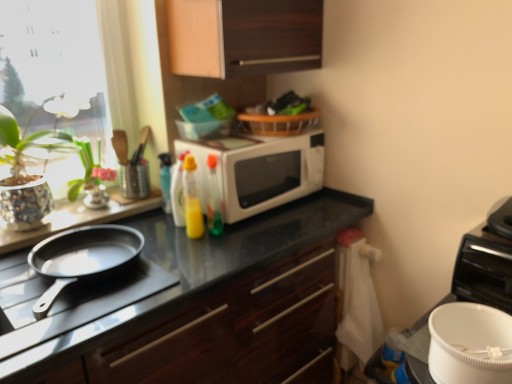
Question: Considering the relative sizes of white glossy microwave at center and green glossy vase at left in the image provided, is white glossy microwave at center smaller than green glossy vase at left?

Choices:
 (A) no
 (B) yes

Answer: (A)

Question: Does white glossy microwave at center have a lesser height compared to green glossy vase at left?

Choices:
 (A) yes
 (B) no

Answer: (B)

Question: Is white glossy microwave at center taller than green glossy vase at left?

Choices:
 (A) yes
 (B) no

Answer: (A)

Question: Could you tell me if white glossy microwave at center is turned towards green glossy vase at left?

Choices:
 (A) no
 (B) yes

Answer: (A)

Question: Does white glossy microwave at center come in front of green glossy vase at left?

Choices:
 (A) no
 (B) yes

Answer: (B)

Question: Looking at the image, does black matte pan at left seem bigger or smaller compared to white glossy microwave at center?

Choices:
 (A) big
 (B) small

Answer: (B)

Question: Is black matte pan at left taller or shorter than white glossy microwave at center?

Choices:
 (A) tall
 (B) short

Answer: (B)

Question: From the image's perspective, is black matte pan at left above or below white glossy microwave at center?

Choices:
 (A) below
 (B) above

Answer: (A)

Question: From a real-world perspective, relative to white glossy microwave at center, is black matte pan at left vertically above or below?

Choices:
 (A) below
 (B) above

Answer: (A)

Question: From their relative heights in the image, would you say translucent plastic spray bottle at upper center, marked as the fourth bottle in a right-to-left arrangement, is taller or shorter than white glossy microwave at center?

Choices:
 (A) short
 (B) tall

Answer: (A)

Question: Based on their positions, is translucent plastic spray bottle at upper center, the first bottle from the left, located to the left or right of white glossy microwave at center?

Choices:
 (A) right
 (B) left

Answer: (B)

Question: From the image's perspective, is translucent plastic spray bottle at upper center, marked as the fourth bottle in a right-to-left arrangement, positioned above or below white glossy microwave at center?

Choices:
 (A) below
 (B) above

Answer: (A)

Question: Relative to white glossy microwave at center, is translucent plastic spray bottle at upper center, marked as the fourth bottle in a right-to-left arrangement, in front or behind?

Choices:
 (A) front
 (B) behind

Answer: (B)

Question: Is translucent plastic spray bottle at upper center, marked as the fourth bottle in a right-to-left arrangement, taller or shorter than green glossy vase at left?

Choices:
 (A) tall
 (B) short

Answer: (B)

Question: Considering the positions of point (159, 163) and point (81, 182), is point (159, 163) closer or farther from the camera than point (81, 182)?

Choices:
 (A) farther
 (B) closer

Answer: (A)